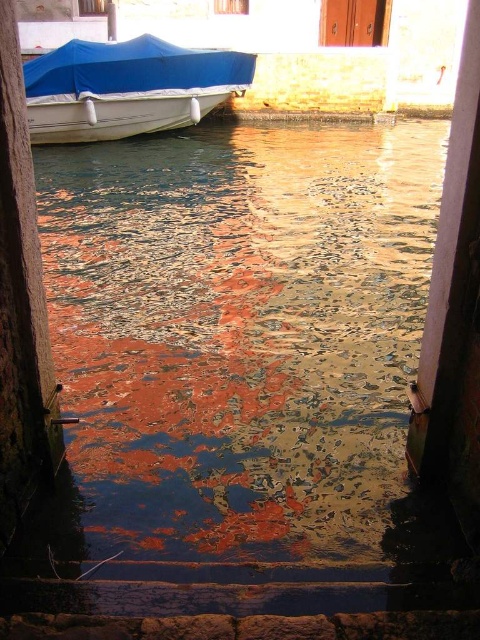
Question: Which of the following is the farthest from the observer?

Choices:
 (A) (60, 140)
 (B) (83, 486)

Answer: (A)

Question: Is reflective water at center to the left of blue tarpaulin boat at upper left from the viewer's perspective?

Choices:
 (A) yes
 (B) no

Answer: (B)

Question: Can you confirm if reflective water at center is wider than blue tarpaulin boat at upper left?

Choices:
 (A) yes
 (B) no

Answer: (A)

Question: Which point appears closest to the camera in this image?

Choices:
 (A) (239, 310)
 (B) (66, 64)

Answer: (A)

Question: Can you confirm if reflective water at center is positioned to the left of blue tarpaulin boat at upper left?

Choices:
 (A) no
 (B) yes

Answer: (A)